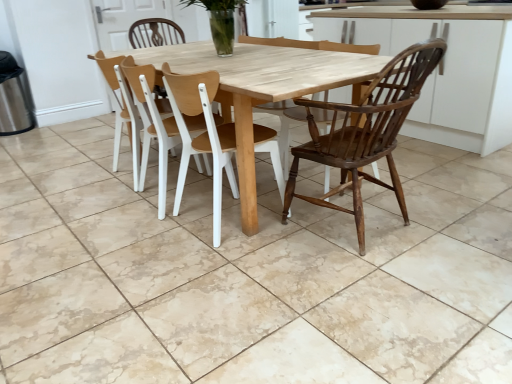
Identify the location of vacant area that lies between wooden chair at center, the 2th chair from the right, and dark brown wood chair at right, the first chair in the right-to-left sequence. The image size is (512, 384). (285, 238).